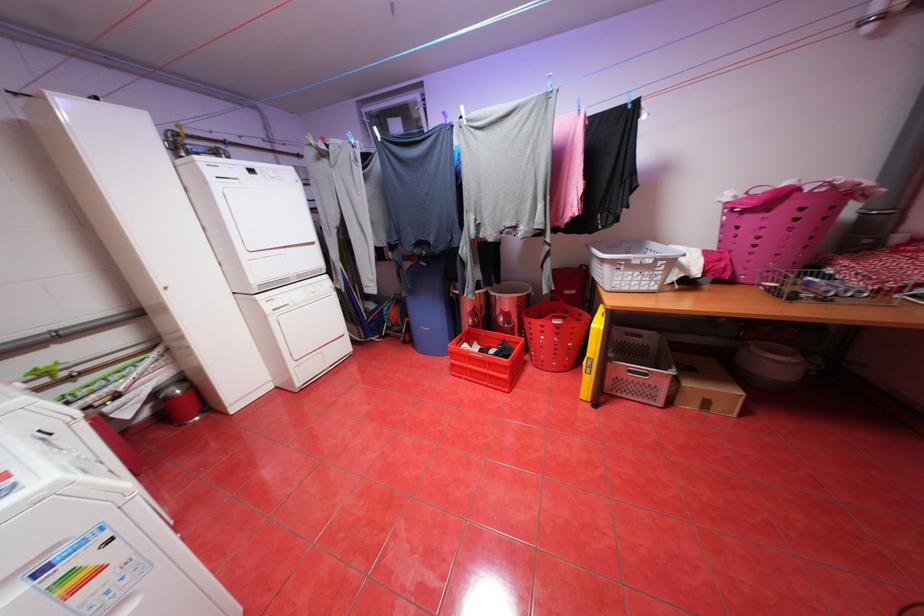
This screenshot has height=616, width=924. Describe the element at coordinates (214, 172) in the screenshot. I see `the detergent drawer handle` at that location.